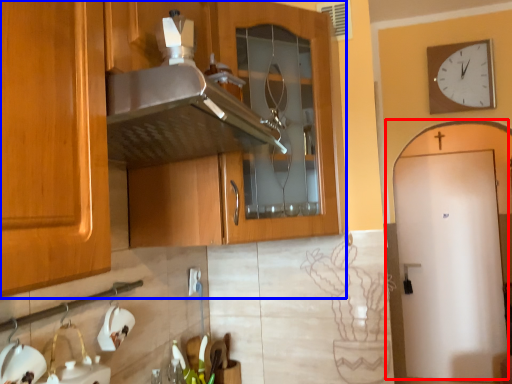
Question: Among these objects, which one is nearest to the camera, door (highlighted by a red box) or cabinetry (highlighted by a blue box)?

Choices:
 (A) door
 (B) cabinetry

Answer: (B)